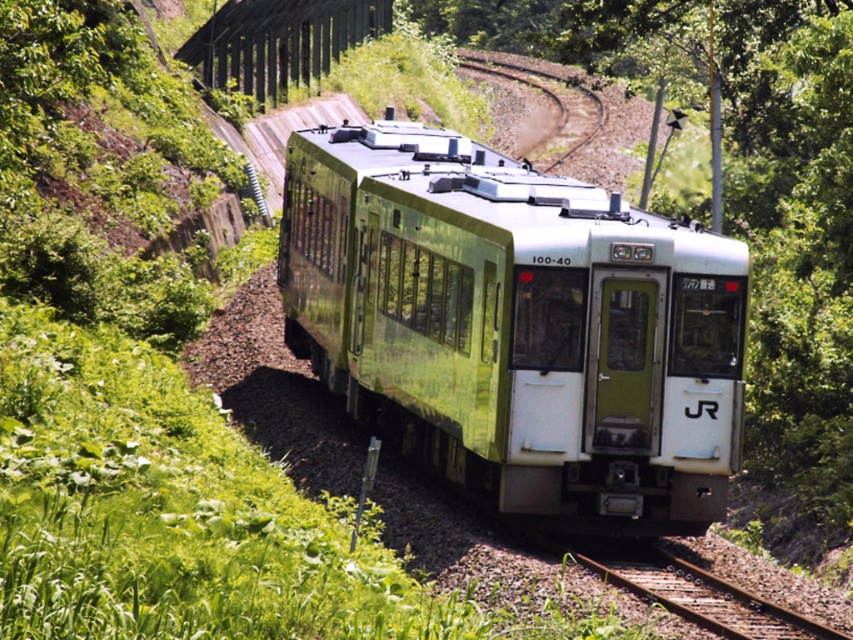
Does green metallic train at center have a lesser height compared to green metallic track at center?

Yes.

Who is more forward, (442, 208) or (550, 164)?

Point (442, 208)

This screenshot has width=853, height=640. What do you see at coordinates (517, 323) in the screenshot?
I see `green metallic train at center` at bounding box center [517, 323].

Where is `green metallic train at center`? The width and height of the screenshot is (853, 640). green metallic train at center is located at coordinates pyautogui.click(x=517, y=323).

Is point (567, 515) in front of point (697, 579)?

That is False.

Does green metallic train at center appear on the right side of rusty metal track at center?

In fact, green metallic train at center is to the left of rusty metal track at center.

The height and width of the screenshot is (640, 853). Identify the location of green metallic train at center. (517, 323).

Which of these two, rusty metal track at center or green metallic track at center, stands shorter?

With less height is rusty metal track at center.

Is rusty metal track at center further to camera compared to green metallic track at center?

No, rusty metal track at center is closer to the viewer.

What do you see at coordinates (704, 596) in the screenshot? I see `rusty metal track at center` at bounding box center [704, 596].

Where is `rusty metal track at center`? Image resolution: width=853 pixels, height=640 pixels. rusty metal track at center is located at coordinates (704, 596).